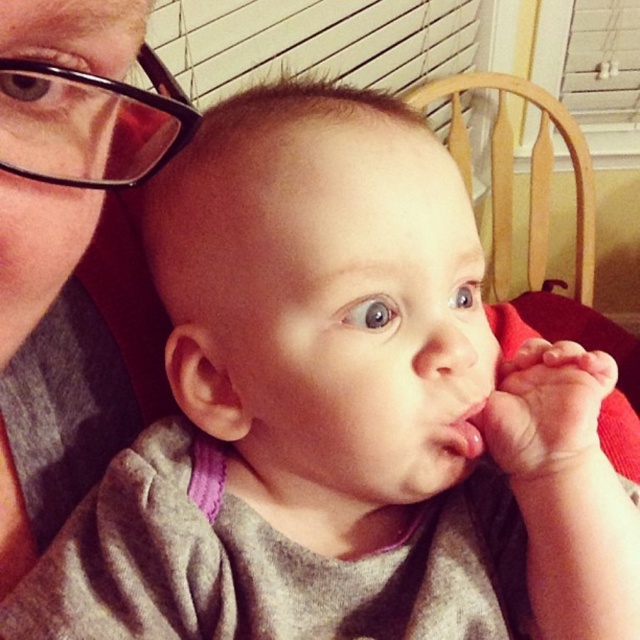
Question: Is black plastic glasses at upper left to the right of wooden chair at center from the viewer's perspective?

Choices:
 (A) yes
 (B) no

Answer: (B)

Question: Among these objects, which one is farthest from the camera?

Choices:
 (A) black plastic glasses at upper left
 (B) wooden chair at center
 (C) pink matte flesh at center

Answer: (B)

Question: Which object appears farthest from the camera in this image?

Choices:
 (A) pink matte flesh at center
 (B) matte gray shirt at upper left

Answer: (A)

Question: Is matte gray shirt at upper left bigger than black plastic glasses at upper left?

Choices:
 (A) no
 (B) yes

Answer: (B)

Question: Can you confirm if wooden chair at center is thinner than pink matte flesh at center?

Choices:
 (A) yes
 (B) no

Answer: (B)

Question: Which point is closer to the camera taking this photo?

Choices:
 (A) (476, 444)
 (B) (35, 72)
 (C) (16, 131)

Answer: (B)